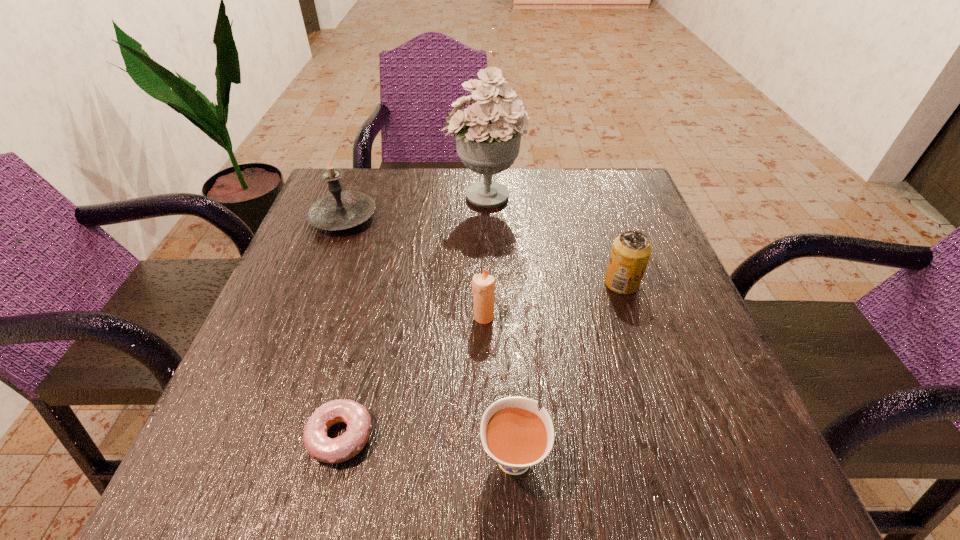
Where is `free area in between the shorter candle and the bouquet`? free area in between the shorter candle and the bouquet is located at coordinates (484, 256).

Locate an element on the screen. Image resolution: width=960 pixels, height=540 pixels. free spot between the shortest object and the farther candle is located at coordinates (342, 327).

Select which object appears as the fourth closest to the nearer candle. Please provide its 2D coordinates. Your answer should be formatted as a tuple, i.e. [(x, y)], where the tuple contains the x and y coordinates of a point satisfying the conditions above.

[(488, 135)]

Identify which object is the closest to the doughnut. Please provide its 2D coordinates. Your answer should be formatted as a tuple, i.e. [(x, y)], where the tuple contains the x and y coordinates of a point satisfying the conditions above.

[(513, 433)]

Identify the location of free space that satisfies the following two spatial constraints: 1. on the side of the beer can with the handle; 2. on the right side of the teacup. This screenshot has width=960, height=540. (504, 283).